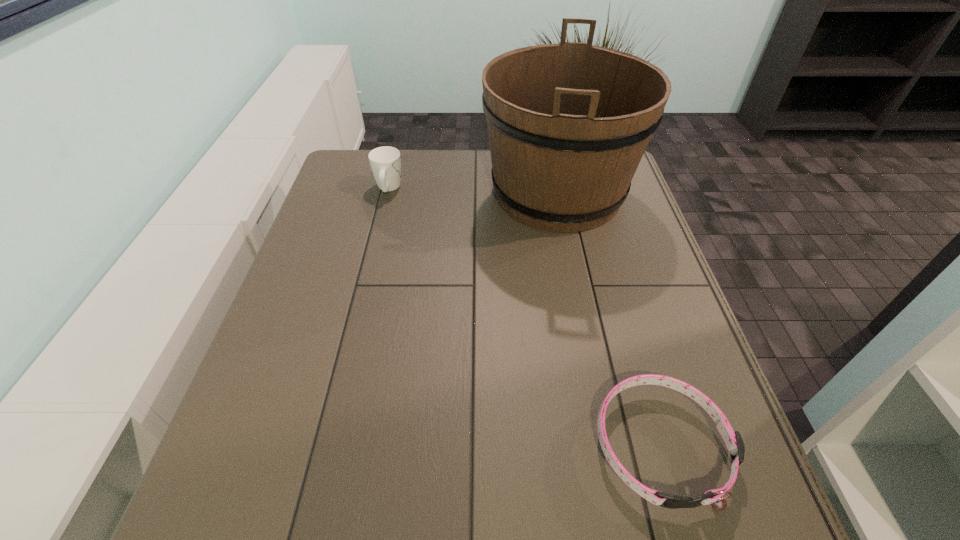
Locate an element on the screen. mug that is at the far edge is located at coordinates (385, 162).

Find the location of a particular element. The width and height of the screenshot is (960, 540). object that is at the near edge is located at coordinates (733, 440).

I want to click on object at the left edge, so click(385, 162).

Where is `bucket that is positioned at the right edge`? Image resolution: width=960 pixels, height=540 pixels. bucket that is positioned at the right edge is located at coordinates (568, 124).

Identify the location of dog collar located in the right edge section of the desktop. (733, 440).

Locate an element on the screen. The height and width of the screenshot is (540, 960). object positioned at the far left corner is located at coordinates coord(385,162).

In order to click on object positioned at the far right corner in this screenshot , I will do `click(568, 124)`.

This screenshot has width=960, height=540. In order to click on object that is at the near right corner in this screenshot , I will do `click(733, 440)`.

In the image, there is a desktop. Identify the location of free space at the far edge. This screenshot has width=960, height=540. (467, 160).

The height and width of the screenshot is (540, 960). I want to click on free space at the near edge of the desktop, so click(557, 526).